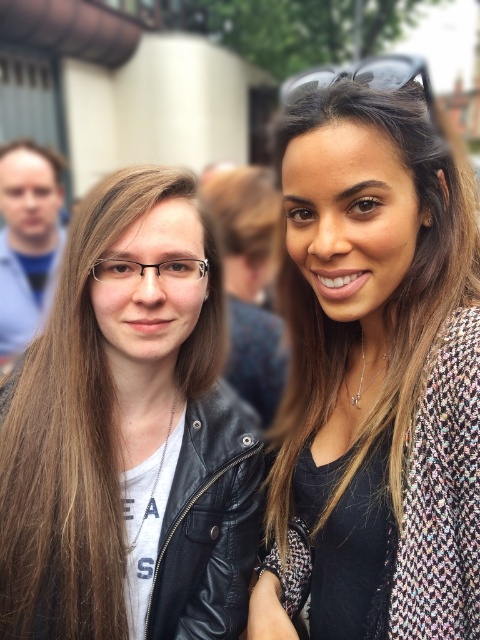
You are a photographer trying to focus on the black plastic goggles at upper center, but the black leather jacket at left is blocking your view. Can you tell which object is closer to you?

The black leather jacket at left is closer to you than the black plastic goggles at upper center, so it is blocking your view.

Based on the scene description, where is the multicolored tweed jacket at upper right located in the image?

The multicolored tweed jacket at upper right is located at the 2D coordinates point (357,339) in the image.

Looking at the two people in the image, which clothing item is positioned to the right of the other? Specifically, is the multicolored tweed jacket at upper right located to the right of the matte blue shirt at left, or vice versa?

The multicolored tweed jacket at upper right is to the right of the matte blue shirt at left.